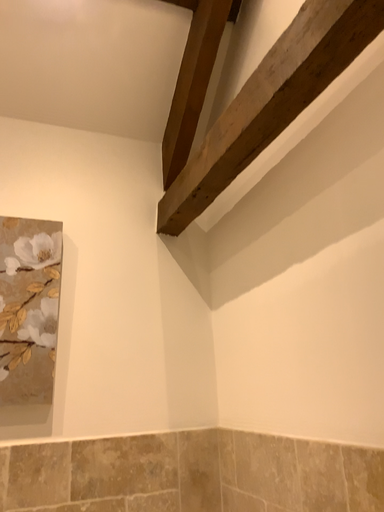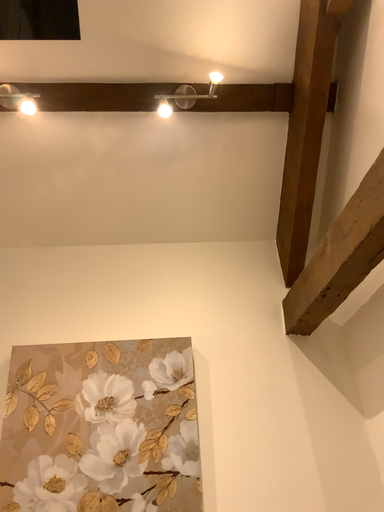
Question: Which way did the camera rotate in the video?

Choices:
 (A) rotated left
 (B) rotated right

Answer: (A)